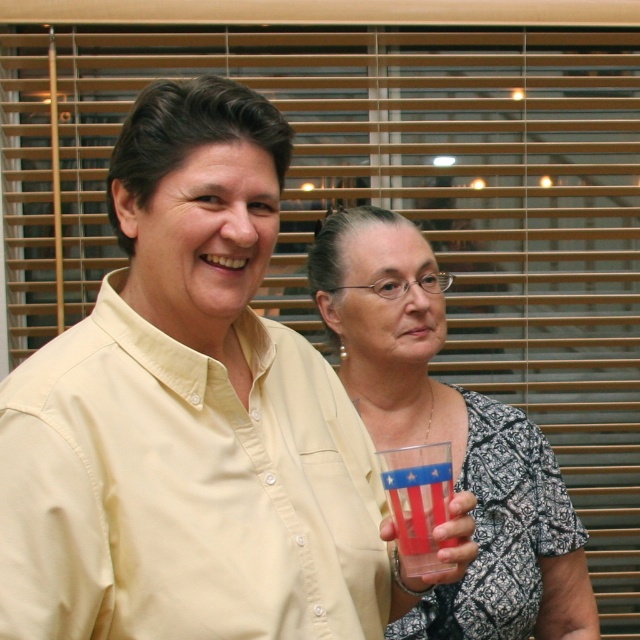
Is translucent plastic cup at center above translucent plastic cup at lower center?

Correct, translucent plastic cup at center is located above translucent plastic cup at lower center.

Between translucent plastic cup at center and translucent plastic cup at lower center, which one appears on the left side from the viewer's perspective?

Positioned to the left is translucent plastic cup at lower center.

In order to click on translucent plastic cup at center in this screenshot , I will do (451, 436).